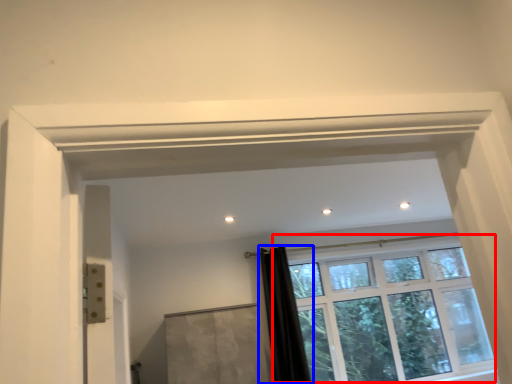
Question: Which of the following is the closest to the observer, window (highlighted by a red box) or shower curtain (highlighted by a blue box)?

Choices:
 (A) window
 (B) shower curtain

Answer: (B)